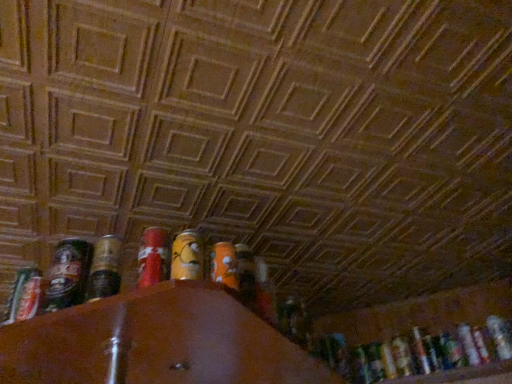
Locate an element on the screen. The width and height of the screenshot is (512, 384). metallic silver spray can at left is located at coordinates [25, 295].

Based on the photo, what is the approximate width of metallic silver spray can at left?

It is 4.51 centimeters.

You are a GUI agent. You are given a task and a screenshot of the screen. Output one action in this format:
    pyautogui.click(x=<x>, y=<y>)
    Task: Click on the metallic silver can at lower right, the third beer when ordered from front to back
    Image resolution: width=512 pixels, height=384 pixels.
    Given the screenshot: What is the action you would take?
    pyautogui.click(x=481, y=344)

In order to click on metallic silver can at lower right, which appears as the 3th beer when viewed from the left in this screenshot , I will do `click(421, 350)`.

What do you see at coordinates (500, 336) in the screenshot?
I see `translucent plastic bottle at lower right, the 5th beer in the back-to-front sequence` at bounding box center [500, 336].

The image size is (512, 384). Find the location of `shiny metallic can at lower right, which appears as the 2th beer when viewed from the left`. shiny metallic can at lower right, which appears as the 2th beer when viewed from the left is located at coordinates (402, 356).

Identify the location of shiny metallic can at left, the first beer positioned from the front. Image resolution: width=512 pixels, height=384 pixels. (68, 274).

Image resolution: width=512 pixels, height=384 pixels. What are the coordinates of `metallic silver spray can at left` in the screenshot? It's located at (25, 295).

Would you say metallic silver spray can at left is part of shiny metallic can at left, the first beer positioned from the front,'s contents?

No, metallic silver spray can at left is not a part of shiny metallic can at left, the first beer positioned from the front.

Where is `spray can lying behind the shiny metallic can at left, the first beer positioned from the front`? The height and width of the screenshot is (384, 512). spray can lying behind the shiny metallic can at left, the first beer positioned from the front is located at coordinates (25, 295).

Between shiny metallic can at left, acting as the first beer starting from the left, and metallic silver spray can at left, which one has smaller size?

Smaller between the two is metallic silver spray can at left.

Is shiny metallic can at left, acting as the first beer starting from the left, taller than metallic silver spray can at left?

Indeed, shiny metallic can at left, acting as the first beer starting from the left, has a greater height compared to metallic silver spray can at left.

Does metallic silver can at lower right, the third beer positioned from the right, have a smaller size compared to metallic silver can at lower right, which appears as the second beer when viewed from the right?

Incorrect, metallic silver can at lower right, the third beer positioned from the right, is not smaller in size than metallic silver can at lower right, which appears as the second beer when viewed from the right.

Looking at this image, is metallic silver can at lower right, which is the 4th beer from front to back, wider than metallic silver can at lower right, which appears as the second beer when viewed from the right?

No.

Relative to metallic silver can at lower right, which appears as the second beer when viewed from the right, is metallic silver can at lower right, the fourth beer positioned from the left, in front or behind?

Clearly, metallic silver can at lower right, the fourth beer positioned from the left, is behind metallic silver can at lower right, which appears as the second beer when viewed from the right.

Is metallic silver can at lower right, which is the 4th beer from front to back, a part of shiny metallic can at left, the 6th beer from the right?

No, metallic silver can at lower right, which is the 4th beer from front to back, is located outside of shiny metallic can at left, the 6th beer from the right.

The image size is (512, 384). What are the coordinates of `the 3rd beer to the left of the metallic silver can at lower right, which is the third beer from back to front, starting your count from the anchor` in the screenshot? It's located at click(68, 274).

Considering the sizes of shiny metallic can at left, acting as the first beer starting from the left, and metallic silver can at lower right, the fourth beer positioned from the left, in the image, is shiny metallic can at left, acting as the first beer starting from the left, wider or thinner than metallic silver can at lower right, the fourth beer positioned from the left,?

shiny metallic can at left, acting as the first beer starting from the left, is thinner than metallic silver can at lower right, the fourth beer positioned from the left.

Considering the relative sizes of shiny metallic can at left, acting as the first beer starting from the left, and metallic silver can at lower right, the fourth beer positioned from the left, in the image provided, is shiny metallic can at left, acting as the first beer starting from the left, smaller than metallic silver can at lower right, the fourth beer positioned from the left,?

No, shiny metallic can at left, acting as the first beer starting from the left, is not smaller than metallic silver can at lower right, the fourth beer positioned from the left.

In the scene shown: Is the depth of metallic silver can at lower right, the third beer positioned from the right, greater than that of metallic silver can at lower right, placed as the 2th beer when sorted from back to front?

No, it is not.

How different are the orientations of metallic silver can at lower right, the fourth beer positioned from the left, and metallic silver can at lower right, which ranks as the fourth beer in right-to-left order, in degrees?

The angle between the facing direction of metallic silver can at lower right, the fourth beer positioned from the left, and the facing direction of metallic silver can at lower right, which ranks as the fourth beer in right-to-left order, is 0.000185 degrees.

Which of these two, metallic silver can at lower right, which is the third beer from back to front, or metallic silver can at lower right, the fifth beer in the front-to-back sequence, is wider?

metallic silver can at lower right, the fifth beer in the front-to-back sequence, is wider.

Would you say metallic silver can at lower right, which is the third beer from back to front, contains metallic silver can at lower right, which ranks as the fourth beer in right-to-left order?

No, metallic silver can at lower right, which ranks as the fourth beer in right-to-left order, is not surrounded by metallic silver can at lower right, which is the third beer from back to front.

Is shiny metallic can at left, the 6th beer from the right, facing away from shiny metallic can at lower right, which appears as the 2th beer when viewed from the left?

No, shiny metallic can at left, the 6th beer from the right, is not facing away from shiny metallic can at lower right, which appears as the 2th beer when viewed from the left.

Is shiny metallic can at left, acting as the first beer starting from the left, touching shiny metallic can at lower right, which ranks as the fifth beer in right-to-left order?

They are not placed beside each other.

Between shiny metallic can at left, the 6th beer from the right, and shiny metallic can at lower right, which ranks as the fifth beer in right-to-left order, which one has larger width?

With larger width is shiny metallic can at lower right, which ranks as the fifth beer in right-to-left order.

From a real-world perspective, is shiny metallic can at left, which is the sixth beer in back-to-front order, on shiny metallic can at lower right, acting as the 1th beer starting from the back?

Yes, from a real-world perspective, shiny metallic can at left, which is the sixth beer in back-to-front order, is above shiny metallic can at lower right, acting as the 1th beer starting from the back.

Is translucent plastic bottle at lower right, the first beer viewed from the right, at the left side of metallic silver can at lower right, which is the 4th beer from front to back?

No.

There is a translucent plastic bottle at lower right, the first beer viewed from the right. Identify the location of the 1st beer above it (from a real-world perspective). (468, 344).

Can you confirm if translucent plastic bottle at lower right, the 5th beer in the back-to-front sequence, is thinner than metallic silver can at lower right, the third beer positioned from the right?

Correct, the width of translucent plastic bottle at lower right, the 5th beer in the back-to-front sequence, is less than that of metallic silver can at lower right, the third beer positioned from the right.

Would you say shiny metallic can at left, the first beer positioned from the front, is outside translucent plastic bottle at lower right, the second beer from the front?

Indeed, shiny metallic can at left, the first beer positioned from the front, is completely outside translucent plastic bottle at lower right, the second beer from the front.

Between shiny metallic can at left, which is the sixth beer in back-to-front order, and translucent plastic bottle at lower right, the first beer viewed from the right, which one is positioned in front?

shiny metallic can at left, which is the sixth beer in back-to-front order, is closer to the camera.

This screenshot has height=384, width=512. Find the location of `the 3rd beer above the translucent plastic bottle at lower right, the first beer viewed from the right (from a real-world perspective)`. the 3rd beer above the translucent plastic bottle at lower right, the first beer viewed from the right (from a real-world perspective) is located at coordinates (68, 274).

Which object is positioned more to the left, shiny metallic can at left, acting as the first beer starting from the left, or translucent plastic bottle at lower right, the second beer from the front?

From the viewer's perspective, shiny metallic can at left, acting as the first beer starting from the left, appears more on the left side.

The image size is (512, 384). I want to click on spray can on the left of shiny metallic can at left, acting as the first beer starting from the left, so 25,295.

At what (x,y) coordinates should I click in order to perform the action: click on the 3rd beer above the metallic silver can at lower right, the third beer when ordered from front to back (from a real-world perspective). Please return your answer as a coordinate pair (x, y). Looking at the image, I should click on (468, 344).

Which object lies further to the anchor point shiny metallic can at lower right, the 6th beer positioned from the front, metallic silver can at lower right, the fifth beer in the front-to-back sequence, or metallic silver spray can at left?

metallic silver spray can at left is further to shiny metallic can at lower right, the 6th beer positioned from the front.

When comparing their distances from translucent plastic bottle at lower right, the 5th beer in the back-to-front sequence, does shiny metallic can at left, the first beer positioned from the front, or metallic silver can at lower right, placed as the 2th beer when sorted from back to front, seem closer?

Among the two, metallic silver can at lower right, placed as the 2th beer when sorted from back to front, is located nearer to translucent plastic bottle at lower right, the 5th beer in the back-to-front sequence.

Based on their spatial positions, is translucent plastic bottle at lower right, the second beer from the front, or shiny metallic can at left, which is the sixth beer in back-to-front order, further from metallic silver spray can at left?

translucent plastic bottle at lower right, the second beer from the front.

Based on the photo, when comparing their distances from metallic silver spray can at left, does metallic silver can at lower right, the third beer when ordered from front to back, or shiny metallic can at lower right, which appears as the 2th beer when viewed from the left, seem closer?

shiny metallic can at lower right, which appears as the 2th beer when viewed from the left, lies closer to metallic silver spray can at left than the other object.

Based on their spatial positions, is shiny metallic can at lower right, which appears as the 2th beer when viewed from the left, or metallic silver can at lower right, the third beer positioned from the right, further from metallic silver can at lower right, which appears as the 3th beer when viewed from the left?

Among the two, metallic silver can at lower right, the third beer positioned from the right, is located further to metallic silver can at lower right, which appears as the 3th beer when viewed from the left.

From the image, which object appears to be farther from translucent plastic bottle at lower right, placed as the sixth beer when sorted from left to right, metallic silver can at lower right, the third beer when ordered from front to back, or metallic silver can at lower right, the third beer positioned from the right?

The object further to translucent plastic bottle at lower right, placed as the sixth beer when sorted from left to right, is metallic silver can at lower right, the third beer positioned from the right.

From the picture: Looking at the image, which one is located further to translucent plastic bottle at lower right, the 5th beer in the back-to-front sequence, shiny metallic can at lower right, acting as the 1th beer starting from the back, or metallic silver spray can at left?

metallic silver spray can at left.

Considering their positions, is metallic silver spray can at left positioned closer to metallic silver can at lower right, which is the third beer from back to front, than metallic silver can at lower right, which ranks as the fifth beer in left-to-right order?

Among the two, metallic silver can at lower right, which ranks as the fifth beer in left-to-right order, is located nearer to metallic silver can at lower right, which is the third beer from back to front.

Identify the location of beer located between shiny metallic can at lower right, acting as the 1th beer starting from the back, and metallic silver can at lower right, which is the third beer from back to front, in the left-right direction. (421, 350).

This screenshot has width=512, height=384. What are the coordinates of `beer between metallic silver can at lower right, placed as the 2th beer when sorted from back to front, and metallic silver can at lower right, which appears as the second beer when viewed from the right, from left to right` in the screenshot? It's located at (468, 344).

Locate an element on the screen. The height and width of the screenshot is (384, 512). beer located between metallic silver can at lower right, the fourth beer positioned from the left, and translucent plastic bottle at lower right, the 5th beer in the back-to-front sequence, in the left-right direction is located at coordinates point(481,344).

Locate an element on the screen. beer situated between shiny metallic can at left, acting as the first beer starting from the left, and metallic silver can at lower right, placed as the 2th beer when sorted from back to front, from left to right is located at coordinates (402, 356).